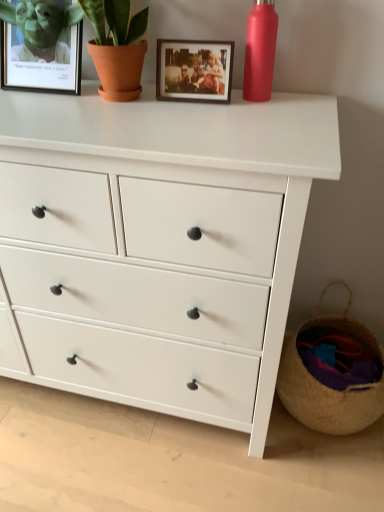
Locate an element on the screen. Image resolution: width=384 pixels, height=512 pixels. free space above white matte chest of drawers at center (from a real-world perspective) is located at coordinates (127, 110).